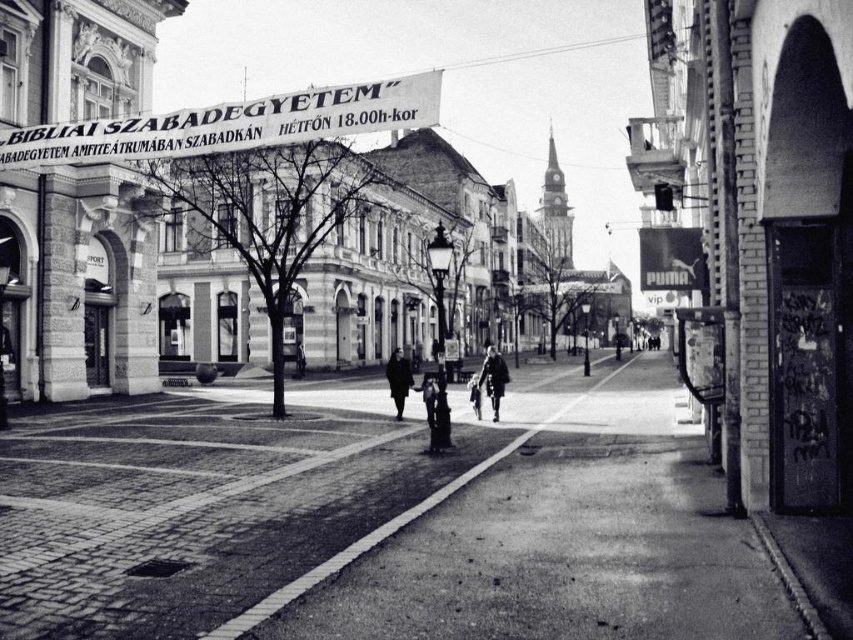
You are a photographer trying to capture both the dark gray coat at center and the dark wool coat at center in a single shot. Given their sizes, which coat would require you to step back more to include it fully in the frame?

The dark wool coat at center requires stepping back more because it occupies more space than the dark gray coat at center.

You are a pedestrian standing on the sidewalk in the European city street scene. You notice both the dark wool coat at center and the shiny chrome motorcycle at center. Which object is taller?

The dark wool coat at center is much taller than the shiny chrome motorcycle at center.